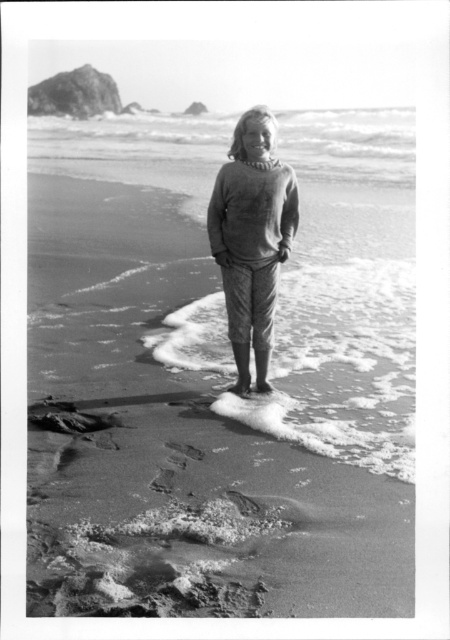
Question: Which of the following is the closest to the observer?

Choices:
 (A) (368, 580)
 (B) (283, 189)

Answer: (A)

Question: Observing the image, what is the correct spatial positioning of smooth sand at center in reference to matte gray sweater at center?

Choices:
 (A) below
 (B) above

Answer: (B)

Question: Which point is farther to the camera?

Choices:
 (A) (239, 369)
 (B) (125, 420)

Answer: (A)

Question: Is smooth sand at center closer to camera compared to matte gray sweater at center?

Choices:
 (A) no
 (B) yes

Answer: (B)

Question: Is smooth sand at center in front of matte gray sweater at center?

Choices:
 (A) no
 (B) yes

Answer: (B)